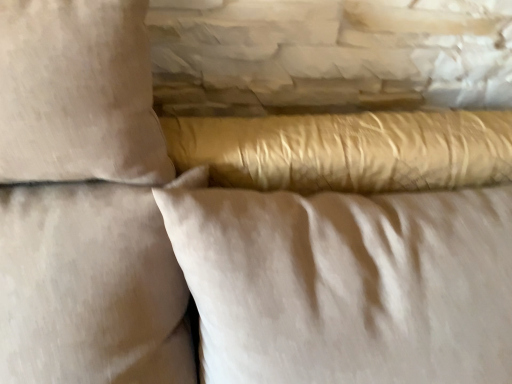
Question: From the image's perspective, would you say satin gold pillow at center, which ranks as the 3th pillow in left-to-right order, is shown under beige fabric pillow at upper left, marked as the first pillow in a left-to-right arrangement?

Choices:
 (A) yes
 (B) no

Answer: (A)

Question: Is beige fabric pillow at upper left, marked as the first pillow in a left-to-right arrangement, surrounded by satin gold pillow at center, which ranks as the 3th pillow in left-to-right order?

Choices:
 (A) no
 (B) yes

Answer: (B)

Question: Can you confirm if satin gold pillow at center, the first pillow in the right-to-left sequence, is thinner than beige fabric pillow at upper left, marked as the first pillow in a left-to-right arrangement?

Choices:
 (A) no
 (B) yes

Answer: (A)

Question: Is satin gold pillow at center, the first pillow in the right-to-left sequence, positioned with its back to beige fabric pillow at upper left, marked as the first pillow in a left-to-right arrangement?

Choices:
 (A) no
 (B) yes

Answer: (B)

Question: Does satin gold pillow at center, the first pillow in the right-to-left sequence, have a smaller size compared to beige fabric pillow at upper left, marked as the first pillow in a left-to-right arrangement?

Choices:
 (A) no
 (B) yes

Answer: (A)

Question: Does satin gold pillow at center, the first pillow in the right-to-left sequence, have a larger size compared to beige fabric pillow at upper left, which is counted as the 3th pillow, starting from the right?

Choices:
 (A) no
 (B) yes

Answer: (B)

Question: From a real-world perspective, is beige fabric pillow at upper left, marked as the first pillow in a left-to-right arrangement, beneath beige cotton pillow at upper left, acting as the second pillow starting from the left?

Choices:
 (A) no
 (B) yes

Answer: (B)

Question: From the image's perspective, is beige fabric pillow at upper left, marked as the first pillow in a left-to-right arrangement, on beige cotton pillow at upper left, marked as the second pillow in a right-to-left arrangement?

Choices:
 (A) yes
 (B) no

Answer: (B)

Question: Can you confirm if beige fabric pillow at upper left, which is counted as the 3th pillow, starting from the right, is taller than beige cotton pillow at upper left, acting as the second pillow starting from the left?

Choices:
 (A) no
 (B) yes

Answer: (B)

Question: Can you confirm if beige fabric pillow at upper left, which is counted as the 3th pillow, starting from the right, is smaller than beige cotton pillow at upper left, acting as the second pillow starting from the left?

Choices:
 (A) yes
 (B) no

Answer: (B)

Question: Can you confirm if beige fabric pillow at upper left, marked as the first pillow in a left-to-right arrangement, is shorter than beige cotton pillow at upper left, marked as the second pillow in a right-to-left arrangement?

Choices:
 (A) no
 (B) yes

Answer: (A)

Question: From a real-world perspective, is beige fabric pillow at upper left, marked as the first pillow in a left-to-right arrangement, over beige cotton pillow at upper left, marked as the second pillow in a right-to-left arrangement?

Choices:
 (A) no
 (B) yes

Answer: (A)

Question: Is beige fabric pillow at upper left, marked as the first pillow in a left-to-right arrangement, located within beige cotton pillow at upper left, acting as the second pillow starting from the left?

Choices:
 (A) yes
 (B) no

Answer: (B)